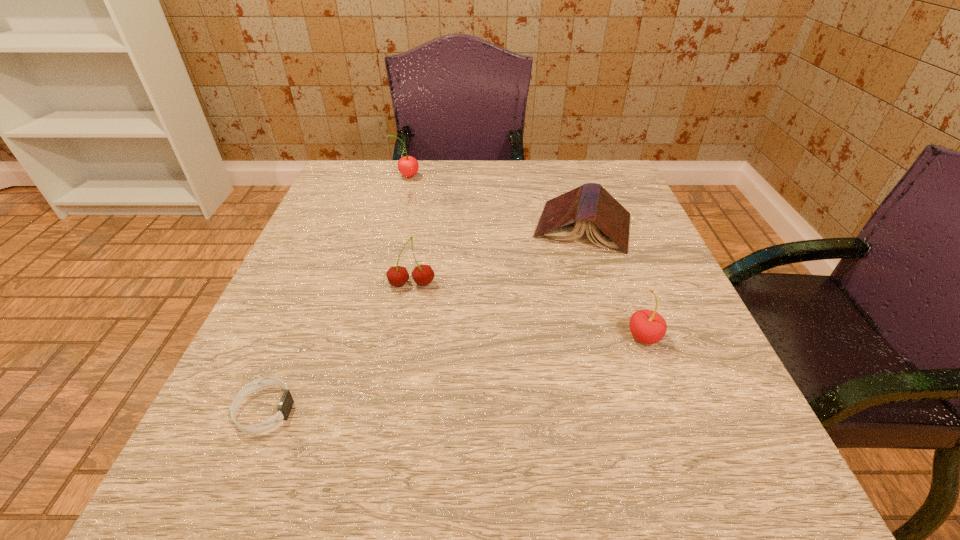
This screenshot has height=540, width=960. Identify the location of object located at the far right corner. (564, 218).

I want to click on free spot at the far edge of the desktop, so click(x=517, y=163).

The width and height of the screenshot is (960, 540). Find the location of `free space at the near edge of the desktop`. free space at the near edge of the desktop is located at coordinates (608, 458).

This screenshot has width=960, height=540. In order to click on free space at the left edge of the desktop in this screenshot , I will do `click(304, 276)`.

At what (x,y) coordinates should I click in order to perform the action: click on vacant space at the right edge of the desktop. Please return your answer as a coordinate pair (x, y). The image size is (960, 540). Looking at the image, I should click on click(x=760, y=435).

In the image, there is a desktop. At what (x,y) coordinates should I click in order to perform the action: click on vacant space at the far left corner. Please return your answer as a coordinate pair (x, y). The image size is (960, 540). Looking at the image, I should click on (357, 180).

Find the location of a particular element. Image resolution: width=960 pixels, height=540 pixels. unoccupied area between the second farthest object and the leftmost object is located at coordinates (424, 319).

Find the location of a particular element. The height and width of the screenshot is (540, 960). vacant area that lies between the rightmost cherry and the shortest object is located at coordinates (454, 374).

This screenshot has width=960, height=540. Identify the location of unoccupied position between the farthest cherry and the rightmost cherry. (525, 256).

Identify the location of vacant area between the farthest object and the nearest object. (336, 293).